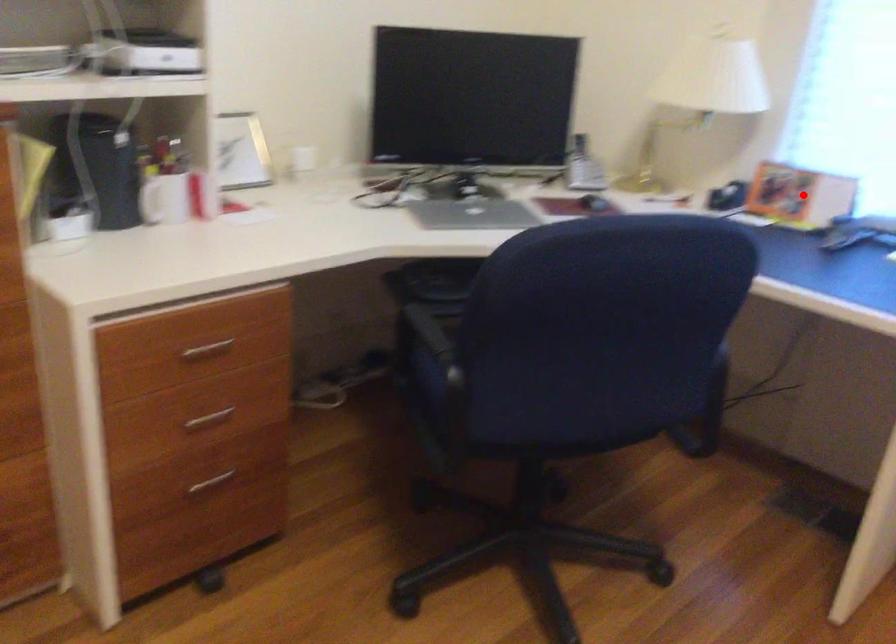
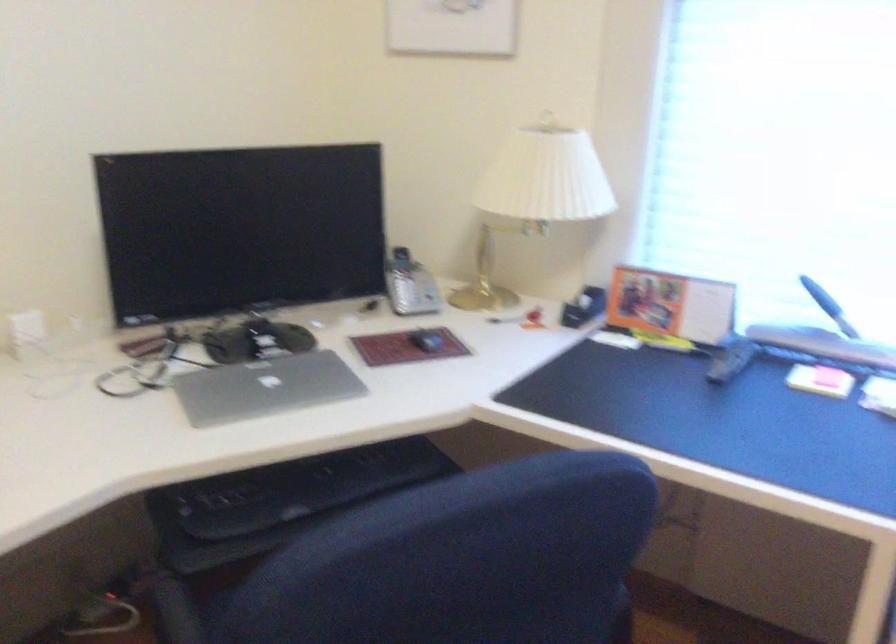
The point at the highlighted location is marked in the first image. Where is the corresponding point in the second image?

(670, 305)